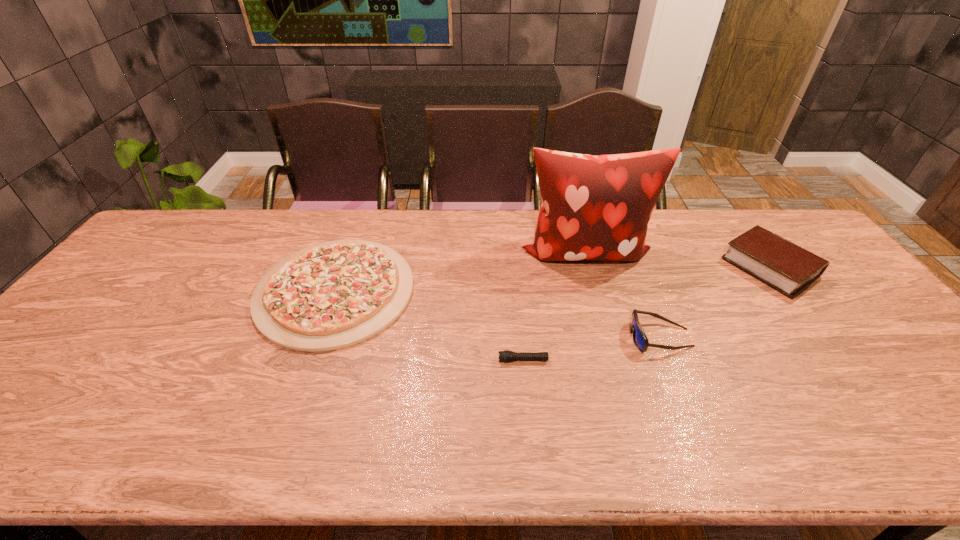
At what (x,y) coordinates should I click in order to perform the action: click on free area in between the sunglasses and the shortest object. Please return your answer as a coordinate pair (x, y). The image size is (960, 540). Looking at the image, I should click on 591,349.

Find the location of a particular element. The height and width of the screenshot is (540, 960). free area in between the sunglasses and the leftmost object is located at coordinates (497, 314).

This screenshot has width=960, height=540. I want to click on the second closest object to the rightmost object, so click(x=640, y=339).

Identify the location of the closest object to the sunglasses. This screenshot has width=960, height=540. (598, 207).

The image size is (960, 540). I want to click on free space in the image that satisfies the following two spatial constraints: 1. on the front-facing side of the tallest object; 2. on the right side of the Bible, so click(x=589, y=267).

This screenshot has width=960, height=540. Identify the location of free space that satisfies the following two spatial constraints: 1. on the back side of the second shortest object; 2. on the left side of the rightmost object. (344, 267).